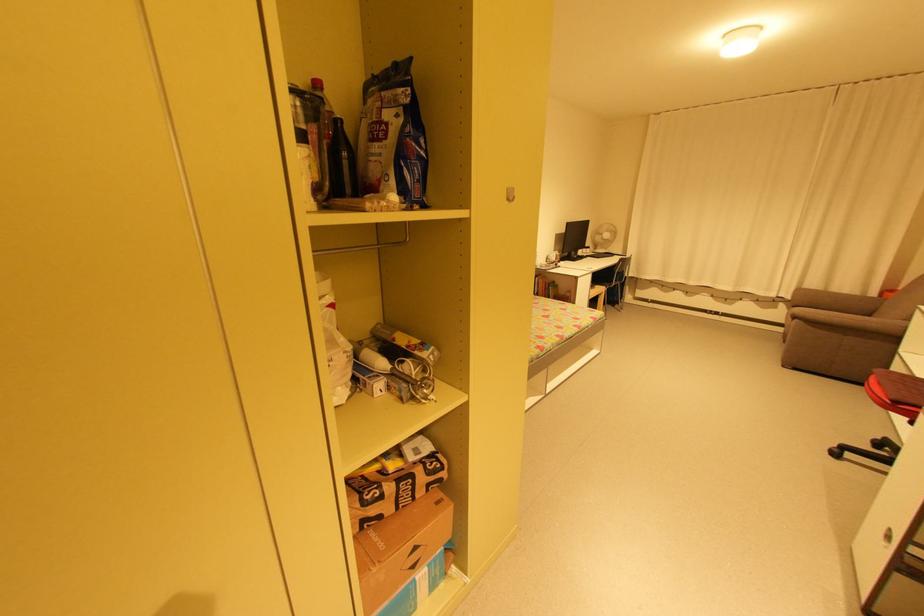
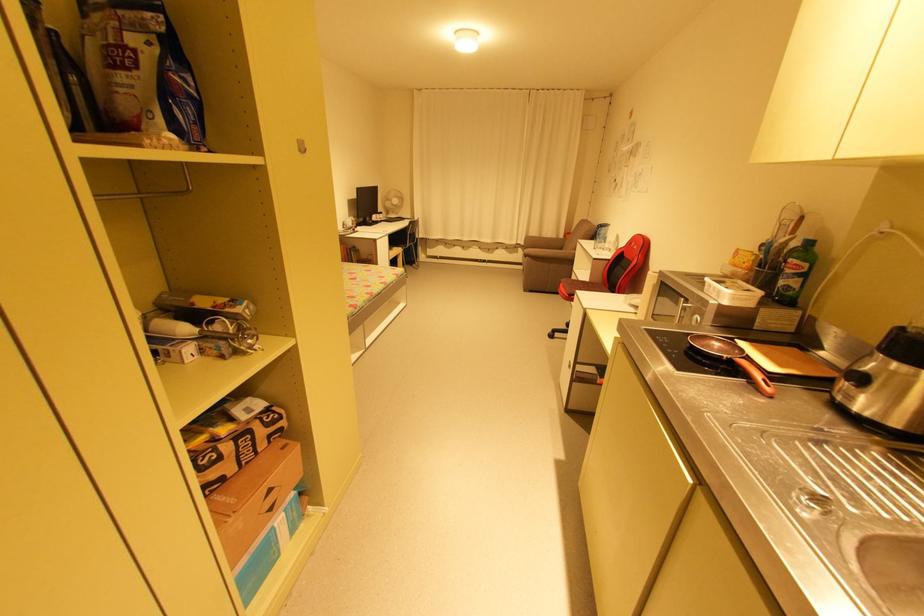
Question: The camera is either moving clockwise (left) or counter-clockwise (right) around the object. The first image is from the beginning of the video and the second image is from the end. Is the camera moving left or right when shooting the video?

Choices:
 (A) Left
 (B) Right

Answer: (A)